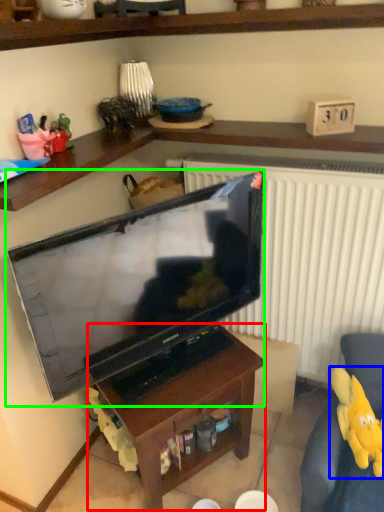
Question: Estimate the real-world distances between objects in this image. Which object is farther from table (highlighted by a red box), toy (highlighted by a blue box) or television (highlighted by a green box)?

Choices:
 (A) toy
 (B) television

Answer: (A)